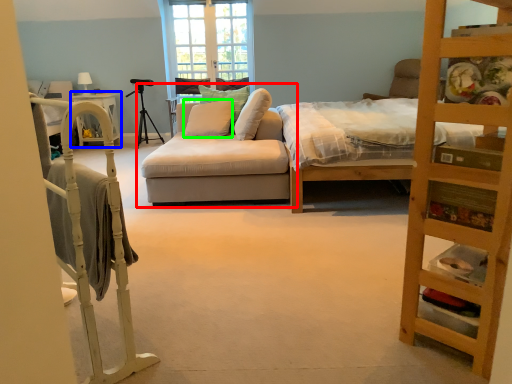
Question: Considering the real-world distances, which object is closest to studio couch (highlighted by a red box)? table (highlighted by a blue box) or pillow (highlighted by a green box).

Choices:
 (A) table
 (B) pillow

Answer: (B)